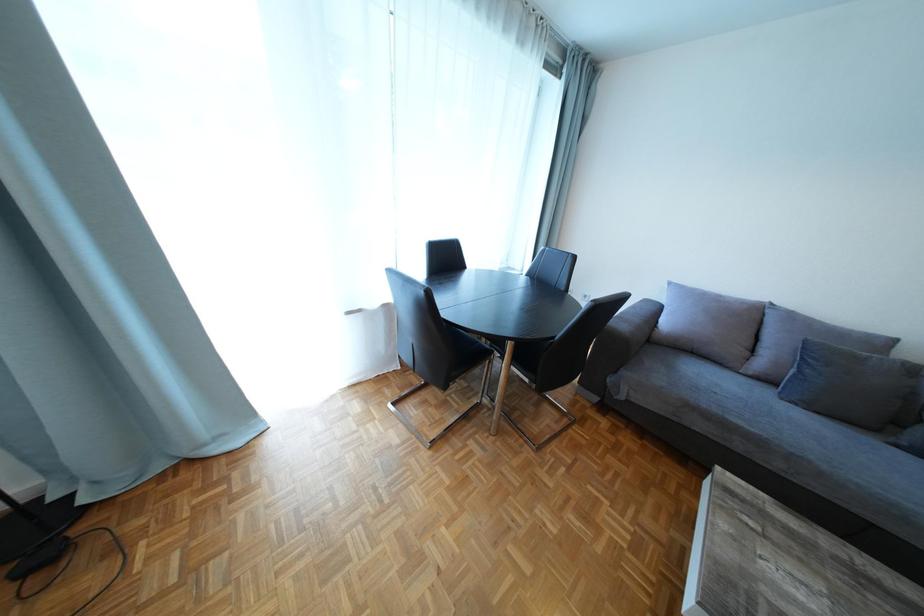
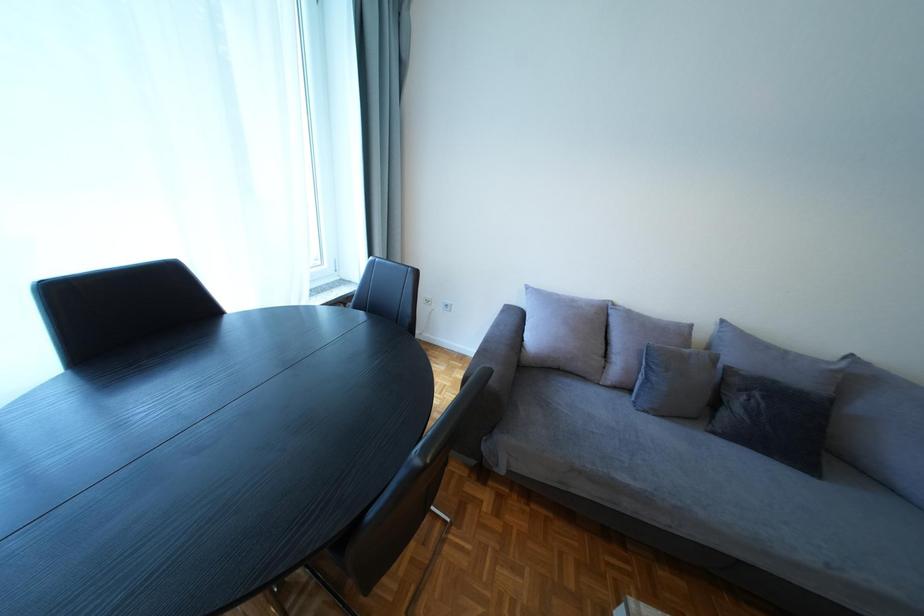
Question: The camera is either moving clockwise (left) or counter-clockwise (right) around the object. The first image is from the beginning of the video and the second image is from the end. Is the camera moving left or right when shooting the video?

Choices:
 (A) Left
 (B) Right

Answer: (A)